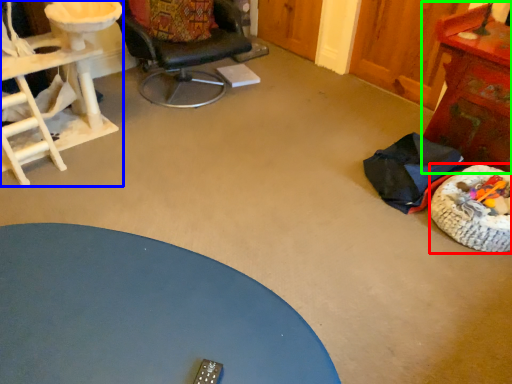
Question: Which object is the closest to the dog bed (highlighted by a red box)? Choose among these: desk (highlighted by a blue box) or table (highlighted by a green box).

Choices:
 (A) desk
 (B) table

Answer: (B)